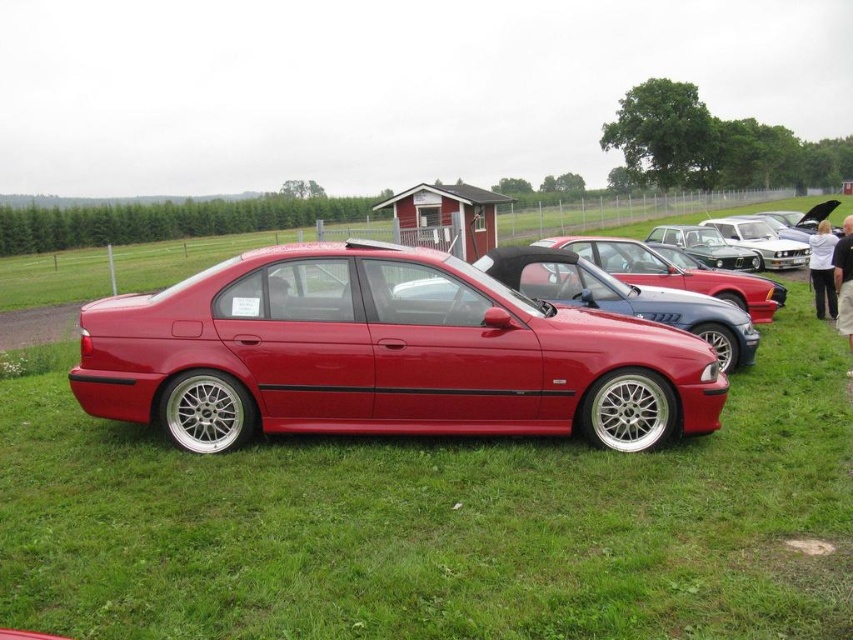
Looking at this image, is glossy metallic car at center closer to camera compared to metallic silver sedan at center?

That is True.

Between point (572, 300) and point (738, 220), which one is positioned in front?

Point (572, 300) is more forward.

Which is in front, point (744, 355) or point (795, 260)?

Positioned in front is point (744, 355).

At what (x,y) coordinates should I click in order to perform the action: click on glossy metallic car at center. Please return your answer as a coordinate pair (x, y). The height and width of the screenshot is (640, 853). Looking at the image, I should click on (622, 298).

Does glossy metallic car at center have a greater height compared to glossy red car at center?

Yes, glossy metallic car at center is taller than glossy red car at center.

Which is behind, point (589, 298) or point (611, 252)?

Positioned behind is point (611, 252).

Measure the distance between glossy metallic car at center and camera.

glossy metallic car at center and camera are 23.46 feet apart from each other.

Where is `glossy metallic car at center`? The height and width of the screenshot is (640, 853). glossy metallic car at center is located at coordinates (622, 298).

Between shiny metallic car at center and glossy red sedan at center, which one appears on the right side from the viewer's perspective?

From the viewer's perspective, shiny metallic car at center appears more on the right side.

Who is more forward, [618,531] or [694,337]?

Point [618,531] is more forward.

This screenshot has width=853, height=640. I want to click on shiny metallic car at center, so click(437, 522).